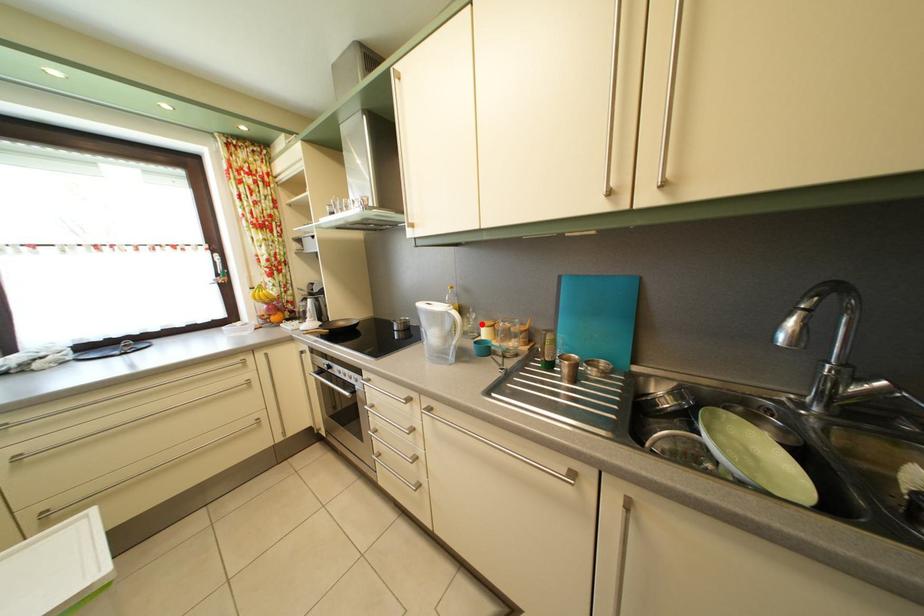
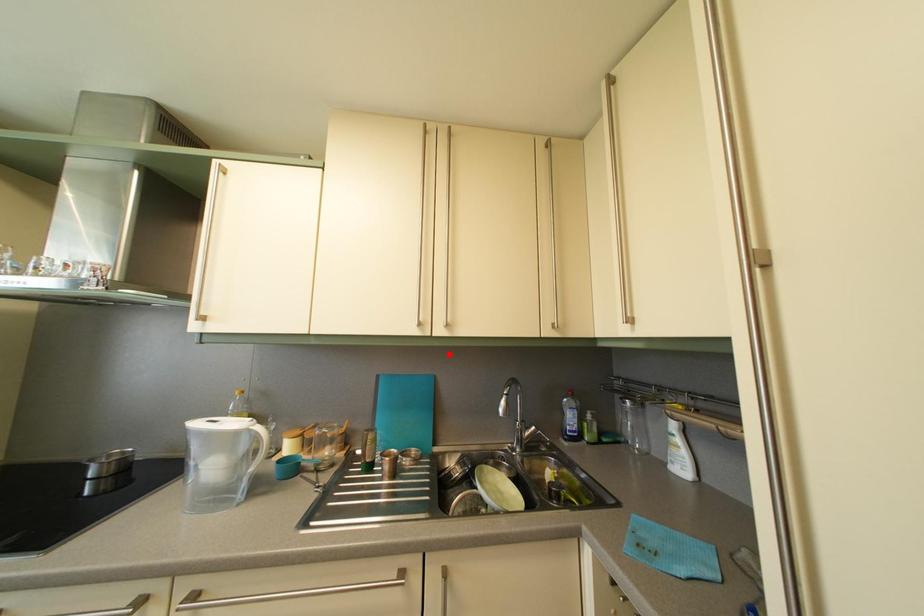
I am providing you with two images of the same scene from different viewpoints. A red point is marked on the first image and another point is marked on the second image. Are the points marked in image1 and image2 representing the same 3D position?

No